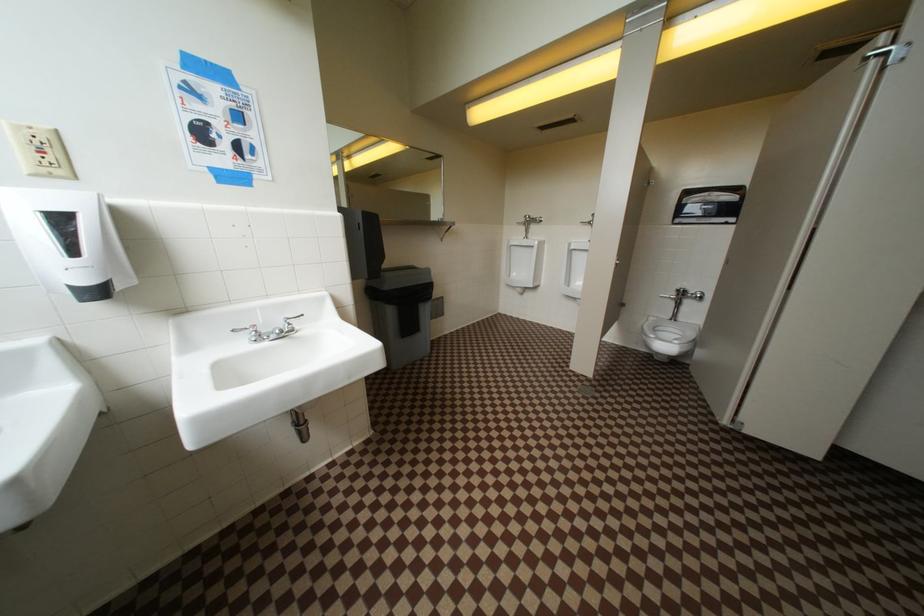
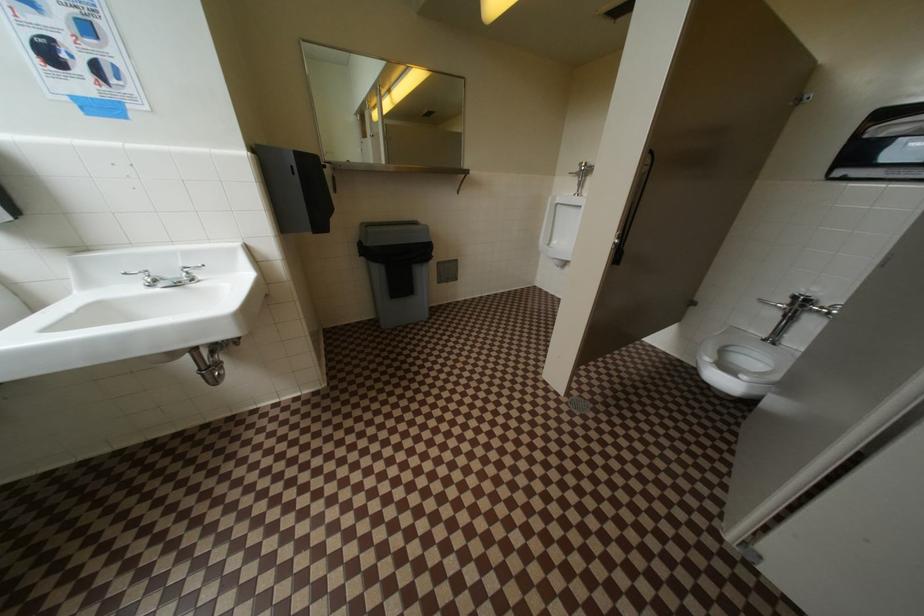
The images are taken continuously from a first-person perspective. In which direction are you moving?

The movement direction of the cameraman is right, forward.